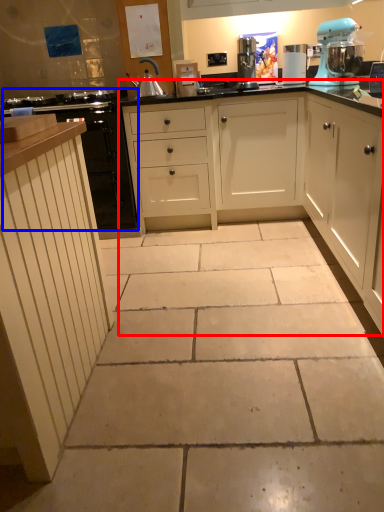
Question: Which object appears closest to the camera in this image, cabinetry (highlighted by a red box) or cabinetry (highlighted by a blue box)?

Choices:
 (A) cabinetry
 (B) cabinetry

Answer: (A)